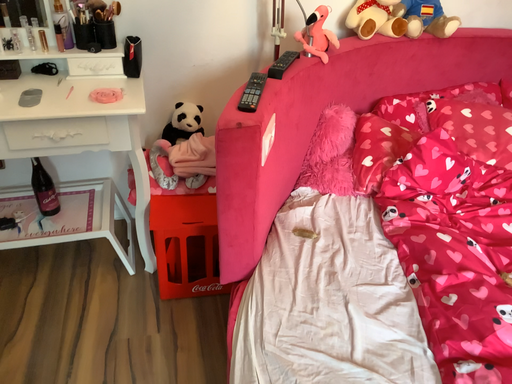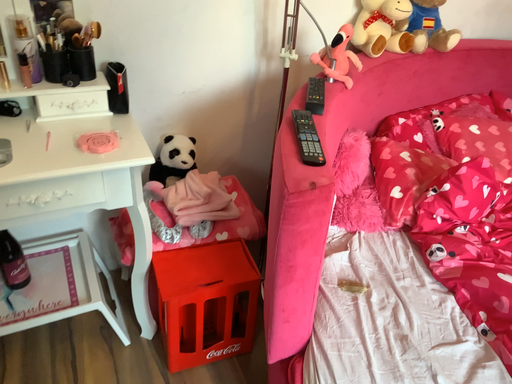
Question: How did the camera likely rotate when shooting the video?

Choices:
 (A) rotated right
 (B) rotated left

Answer: (A)